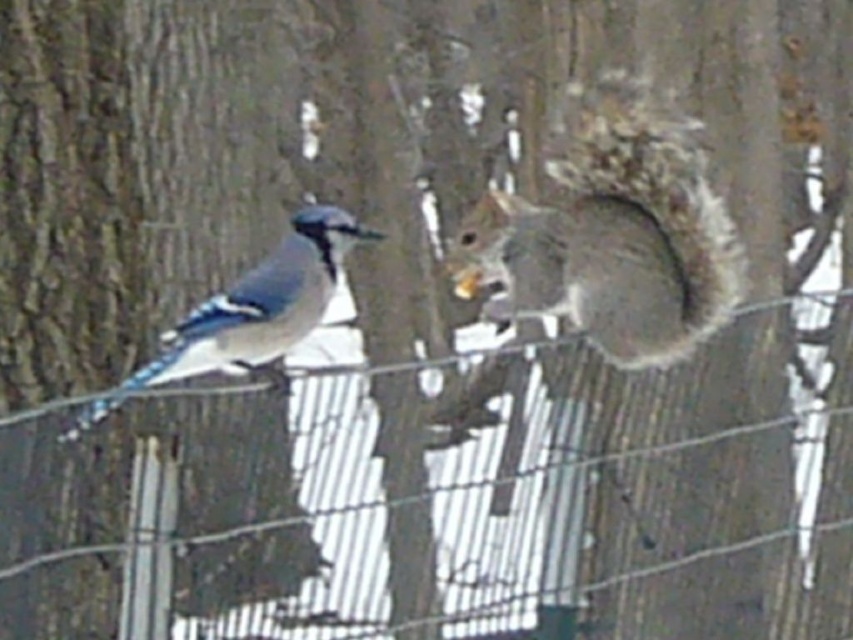
Is fuzzy gray squirrel at center below gray furry squirrel at left?

No, fuzzy gray squirrel at center is not below gray furry squirrel at left.

What do you see at coordinates (613, 237) in the screenshot?
I see `fuzzy gray squirrel at center` at bounding box center [613, 237].

Is point (633, 200) more distant than point (207, 317)?

Yes, it is behind point (207, 317).

The height and width of the screenshot is (640, 853). I want to click on fuzzy gray squirrel at center, so click(613, 237).